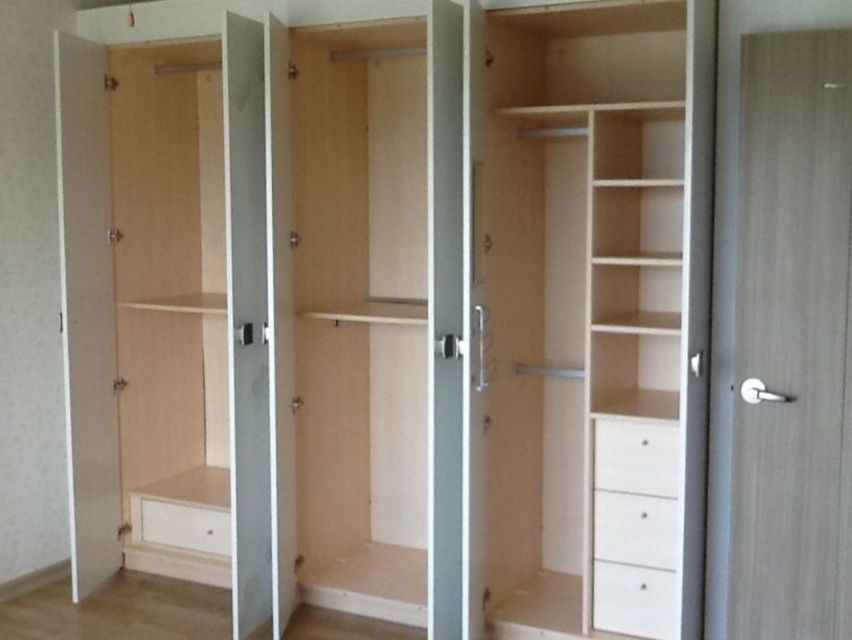
Does point (626, 480) come farther from viewer compared to point (182, 518)?

No, it is not.

Between white matte drawer at lower right and white matte drawer at lower left, which one has more height?

white matte drawer at lower right is taller.

This screenshot has width=852, height=640. Describe the element at coordinates (635, 456) in the screenshot. I see `white matte drawer at lower right` at that location.

Find the location of a particular element. The width and height of the screenshot is (852, 640). white matte drawer at lower right is located at coordinates (635, 456).

Can you confirm if white matte drawer at lower right is positioned to the left of white wood drawer at lower right?

Yes, white matte drawer at lower right is to the left of white wood drawer at lower right.

Is white matte drawer at lower right above white wood drawer at lower right?

Indeed, white matte drawer at lower right is positioned over white wood drawer at lower right.

Measure the distance between point (620,420) and camera.

Point (620,420) and camera are 9.15 feet apart from each other.

The image size is (852, 640). In order to click on white matte drawer at lower right in this screenshot , I will do `click(635, 456)`.

Can you confirm if white wood drawer at lower right is thinner than white matte drawer at lower left?

Indeed, white wood drawer at lower right has a lesser width compared to white matte drawer at lower left.

Does point (619, 572) lie behind point (183, 536)?

No, (619, 572) is closer to viewer.

Is point (628, 609) farther from camera compared to point (154, 508)?

No, (628, 609) is in front of (154, 508).

Where is `white wood drawer at lower right`? This screenshot has width=852, height=640. white wood drawer at lower right is located at coordinates (632, 600).